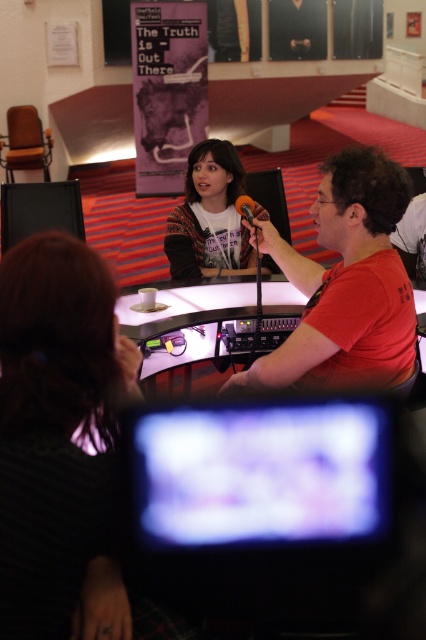
How far apart are dark brown hair at lower left and fuzzy sweater at center?

dark brown hair at lower left and fuzzy sweater at center are 5.45 feet apart.

Is dark brown hair at lower left above fuzzy sweater at center?

No.

Is point (80, 276) closer to camera compared to point (218, 246)?

Yes, it is in front of point (218, 246).

This screenshot has width=426, height=640. What are the coordinates of `dark brown hair at lower left` in the screenshot? It's located at (60, 436).

Is blurred plastic screen at center taller than black matte microphone at center?

Yes, blurred plastic screen at center is taller than black matte microphone at center.

This screenshot has width=426, height=640. What do you see at coordinates (264, 474) in the screenshot? I see `blurred plastic screen at center` at bounding box center [264, 474].

Does point (187, 449) come closer to viewer compared to point (241, 196)?

Yes, it is in front of point (241, 196).

Where is `blurred plastic screen at center`? The image size is (426, 640). blurred plastic screen at center is located at coordinates (264, 474).

Is white glossy table at center shorter than fuzzy sweater at center?

Indeed, white glossy table at center has a lesser height compared to fuzzy sweater at center.

Is point (183, 320) closer to viewer compared to point (192, 230)?

Yes.

The width and height of the screenshot is (426, 640). I want to click on white glossy table at center, so tap(190, 323).